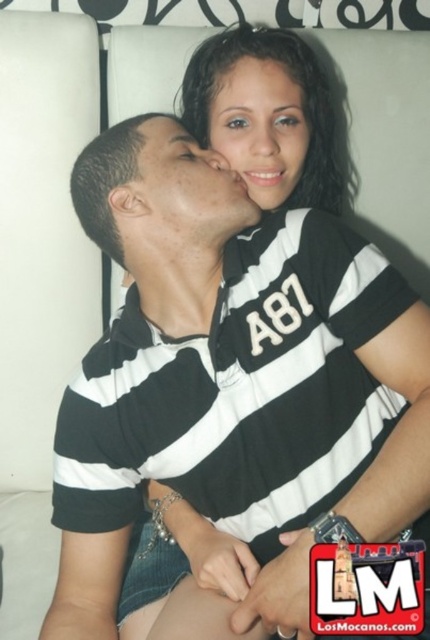
Identify the location of black striped polo shirt at center. The width and height of the screenshot is (430, 640). (239, 390).

Who is more distant from viewer, [326,476] or [283,138]?

The point [283,138] is more distant.

Who is more distant from viewer, (372, 406) or (245, 106)?

Point (245, 106)

Where is `black striped polo shirt at center`? This screenshot has height=640, width=430. black striped polo shirt at center is located at coordinates (239, 390).

Who is positioned more to the left, black striped polo shirt at center or black striped shirt at upper center?

black striped polo shirt at center is more to the left.

Is black striped polo shirt at center closer to camera compared to black striped shirt at upper center?

Yes, black striped polo shirt at center is in front of black striped shirt at upper center.

Describe the element at coordinates (239, 390) in the screenshot. The width and height of the screenshot is (430, 640). I see `black striped polo shirt at center` at that location.

Locate an element on the screen. black striped polo shirt at center is located at coordinates (239, 390).

Is black striped shirt at upper center positioned before matte black face at upper center?

No, black striped shirt at upper center is further to the viewer.

Does black striped shirt at upper center appear on the right side of matte black face at upper center?

Correct, you'll find black striped shirt at upper center to the right of matte black face at upper center.

Who is more forward, (266, 141) or (254, 106)?

Point (266, 141)

Find the location of a particular element. Image resolution: width=430 pixels, height=640 pixels. black striped shirt at upper center is located at coordinates (270, 116).